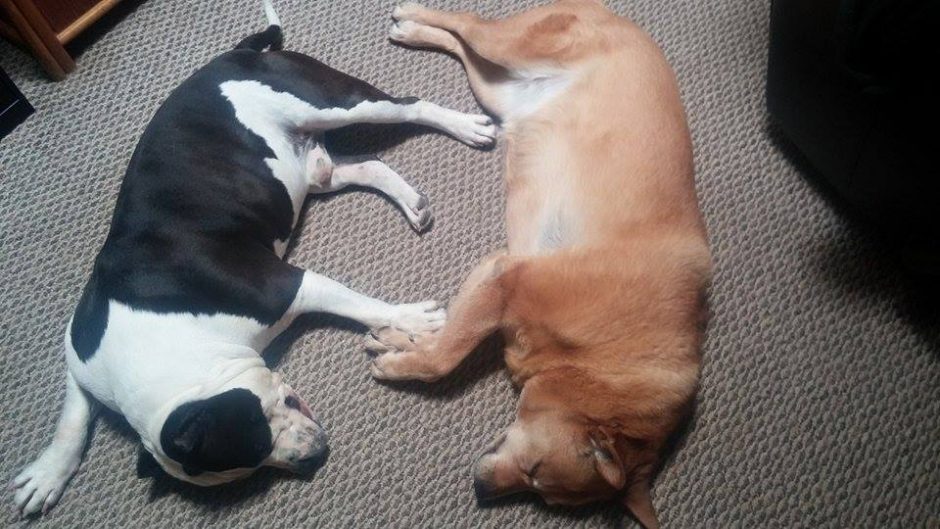
Locate an element on the screen. carpet is located at coordinates (395, 460), (810, 446), (404, 263), (449, 176), (336, 16), (98, 96), (24, 72), (494, 4), (107, 494), (34, 271).